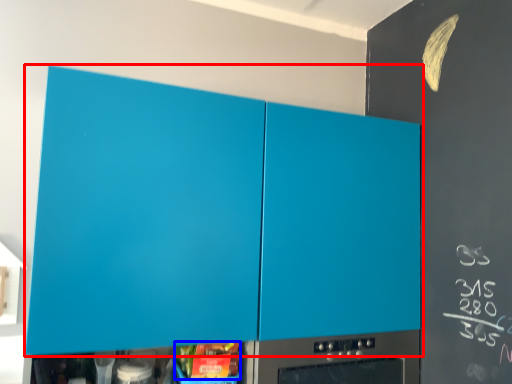
Question: Which point is further to the camera, cabinetry (highlighted by a red box) or food (highlighted by a blue box)?

Choices:
 (A) cabinetry
 (B) food

Answer: (B)